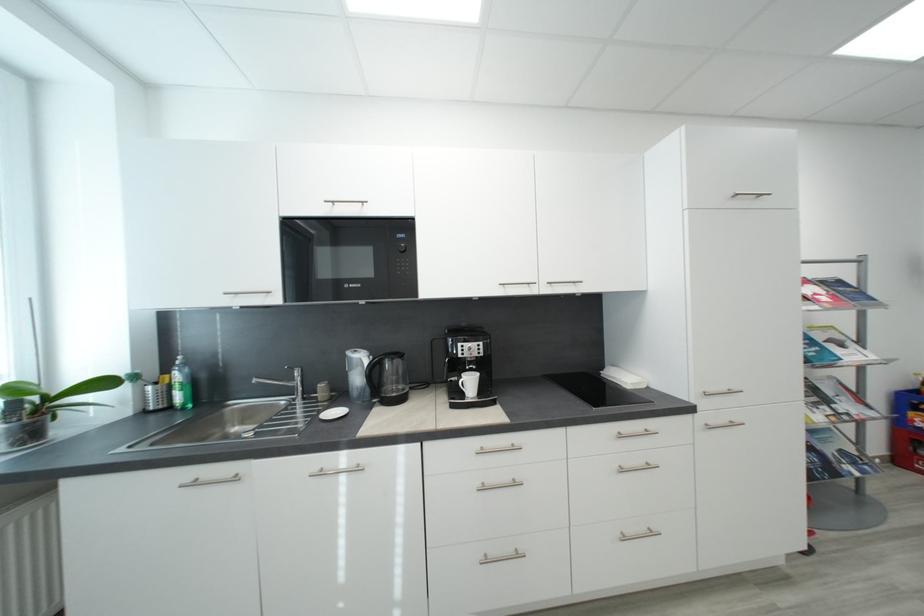
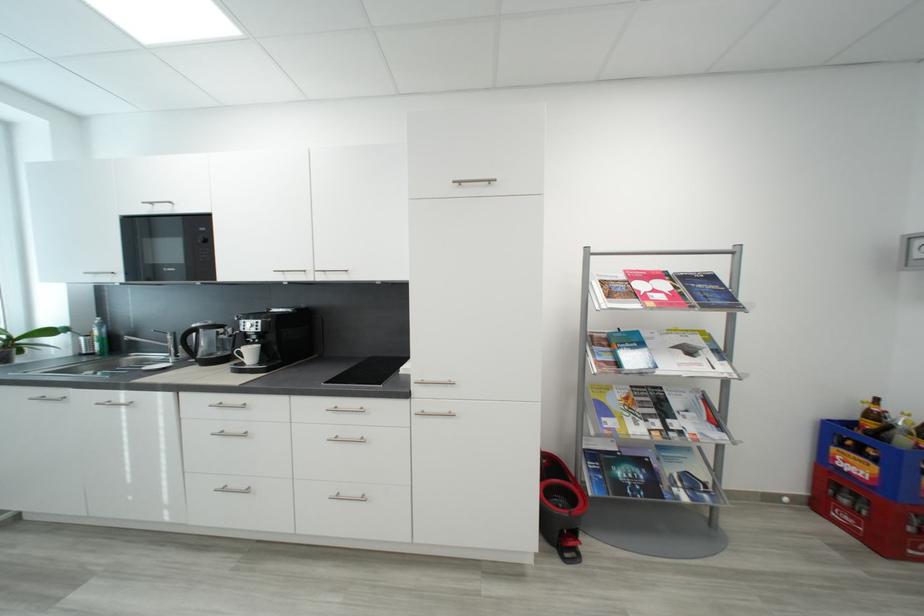
Find the pixel in the second image that matches (477,384) in the first image.

(257, 354)